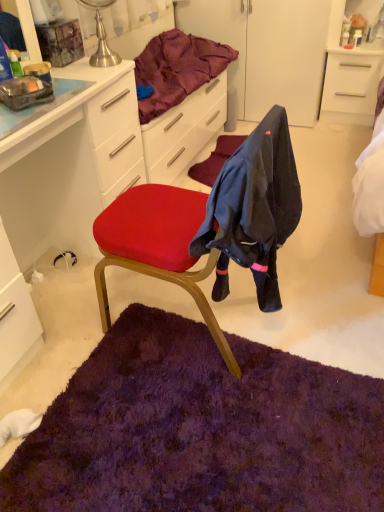
Question: Can you confirm if white glossy cabinet at upper right, the second cabinetry when ordered from front to back, is bigger than dark blue fabric at center?

Choices:
 (A) yes
 (B) no

Answer: (B)

Question: Can you confirm if white glossy cabinet at upper right, acting as the 1th cabinetry starting from the back, is smaller than dark blue fabric at center?

Choices:
 (A) yes
 (B) no

Answer: (A)

Question: From a real-world perspective, is white glossy cabinet at upper right, positioned as the 2th cabinetry in bottom-to-top order, over dark blue fabric at center?

Choices:
 (A) no
 (B) yes

Answer: (A)

Question: Is the depth of white glossy cabinet at upper right, the second cabinetry when ordered from front to back, greater than that of dark blue fabric at center?

Choices:
 (A) yes
 (B) no

Answer: (A)

Question: From a real-world perspective, is white glossy cabinet at upper right, the second cabinetry when ordered from front to back, under dark blue fabric at center?

Choices:
 (A) yes
 (B) no

Answer: (A)

Question: From the image's perspective, is white glossy cabinet at upper right, the second cabinetry when ordered from left to right, located above dark blue fabric at center?

Choices:
 (A) no
 (B) yes

Answer: (B)

Question: Can you confirm if velvet red chair at center is thinner than velvet purple blanket at upper center?

Choices:
 (A) yes
 (B) no

Answer: (B)

Question: From the image's perspective, is velvet red chair at center above velvet purple blanket at upper center?

Choices:
 (A) yes
 (B) no

Answer: (B)

Question: Considering the relative sizes of velvet red chair at center and velvet purple blanket at upper center in the image provided, is velvet red chair at center taller than velvet purple blanket at upper center?

Choices:
 (A) no
 (B) yes

Answer: (B)

Question: Can you confirm if velvet red chair at center is wider than velvet purple blanket at upper center?

Choices:
 (A) no
 (B) yes

Answer: (B)

Question: Considering the relative sizes of velvet red chair at center and velvet purple blanket at upper center in the image provided, is velvet red chair at center smaller than velvet purple blanket at upper center?

Choices:
 (A) no
 (B) yes

Answer: (A)

Question: Does velvet red chair at center lie in front of velvet purple blanket at upper center?

Choices:
 (A) no
 (B) yes

Answer: (B)

Question: Is white glossy cabinet at upper right, the first cabinetry in the right-to-left sequence, facing towards velvet red chair at center?

Choices:
 (A) no
 (B) yes

Answer: (B)